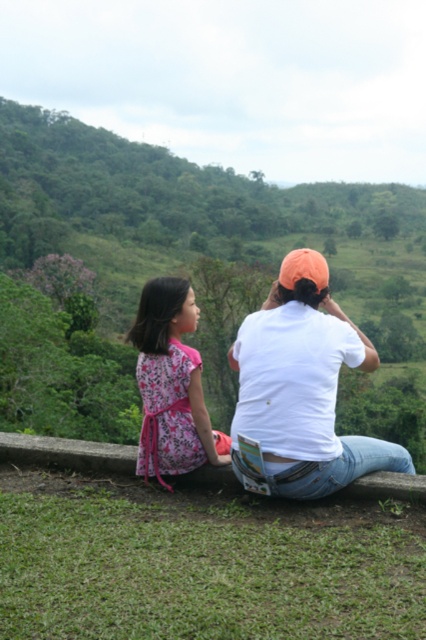
Question: Does white cotton shirt at center have a larger size compared to concrete ledge at center?

Choices:
 (A) yes
 (B) no

Answer: (A)

Question: Which object is positioned farthest from the floral fabric dress at left?

Choices:
 (A) concrete ledge at center
 (B) white cotton shirt at center

Answer: (A)

Question: Considering the real-world distances, which object is farthest from the concrete ledge at center?

Choices:
 (A) floral fabric dress at left
 (B) white cotton shirt at center

Answer: (B)

Question: Which point is farther to the camera?

Choices:
 (A) white cotton shirt at center
 (B) floral fabric dress at left
 (C) concrete ledge at center

Answer: (B)

Question: Can you confirm if floral fabric dress at left is smaller than concrete ledge at center?

Choices:
 (A) no
 (B) yes

Answer: (A)

Question: Is white cotton shirt at center closer to camera compared to concrete ledge at center?

Choices:
 (A) yes
 (B) no

Answer: (A)